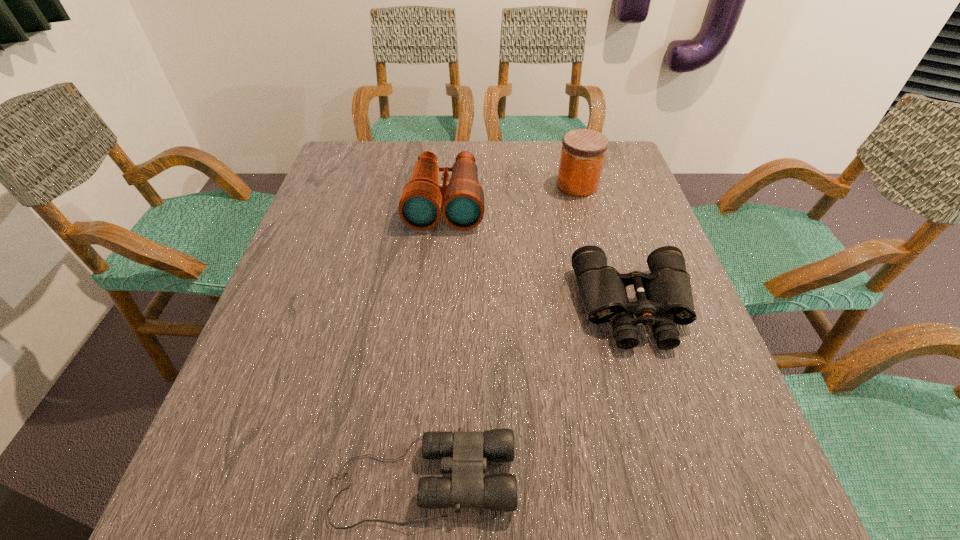
This screenshot has height=540, width=960. In order to click on free space at the near left corner in this screenshot , I will do click(225, 503).

You are a GUI agent. You are given a task and a screenshot of the screen. Output one action in this format:
    pyautogui.click(x=<x>, y=<y>)
    Task: Click on the free space at the far right corner of the desktop
    This screenshot has height=540, width=960.
    Given the screenshot: What is the action you would take?
    pyautogui.click(x=621, y=145)

In order to click on vacant space at the near right corner of the desktop in this screenshot , I will do `click(771, 514)`.

Find the location of a particular element. This screenshot has height=540, width=960. vacant space that is in between the jar and the nearest object is located at coordinates (500, 333).

Identify the location of vacant area between the shortest object and the third farthest object. (528, 394).

The width and height of the screenshot is (960, 540). Find the location of `empty location between the second shortest binoculars and the nearest binoculars`. empty location between the second shortest binoculars and the nearest binoculars is located at coordinates (x=528, y=394).

Find the location of a particular element. Image resolution: width=960 pixels, height=540 pixels. free space between the nearest binoculars and the third shortest object is located at coordinates [434, 341].

Identify the location of empty space that is in between the nearest binoculars and the second nearest binoculars. (528, 394).

At what (x,y) coordinates should I click in order to perform the action: click on vacant area that lies between the rightmost binoculars and the nearest binoculars. Please return your answer as a coordinate pair (x, y). The height and width of the screenshot is (540, 960). Looking at the image, I should click on (528, 394).

The image size is (960, 540). Identify the location of empty space between the jar and the nearest binoculars. (500, 333).